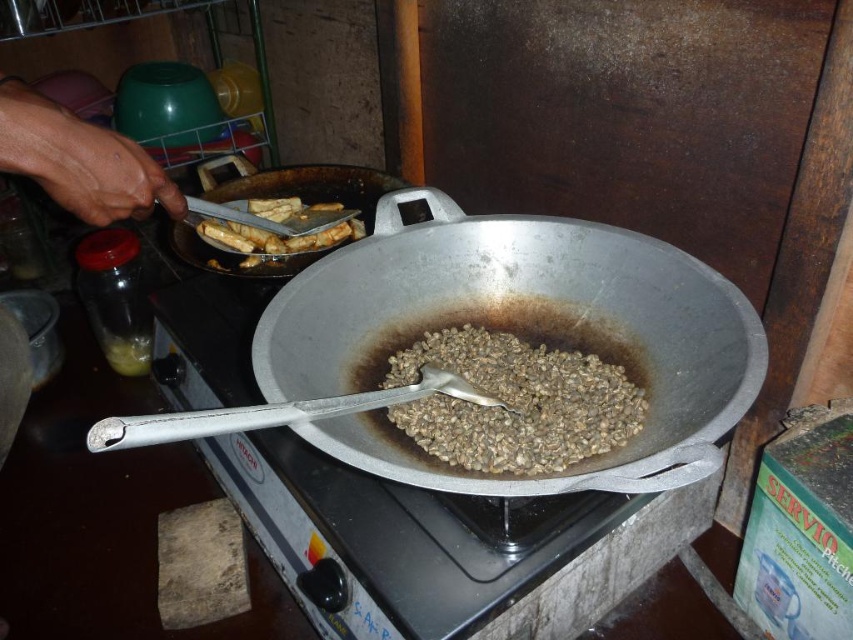
Question: Does shiny silver wok at center have a greater width compared to brown matte beans at center?

Choices:
 (A) yes
 (B) no

Answer: (A)

Question: Is brown matte beans at center closer to the viewer compared to silver metallic frying pan at center?

Choices:
 (A) yes
 (B) no

Answer: (A)

Question: Which point is farther to the camera?

Choices:
 (A) shiny silver wok at center
 (B) silver metallic frying pan at center
 (C) brown crispy fried food at upper left
 (D) brown matte beans at center

Answer: (B)

Question: Based on their relative distances, which object is nearer to the brown crispy fried food at upper left?

Choices:
 (A) brown matte beans at center
 (B) shiny silver wok at center

Answer: (B)

Question: Is brown matte beans at center closer to the viewer compared to silver metallic frying pan at center?

Choices:
 (A) yes
 (B) no

Answer: (A)

Question: Which point is closer to the camera taking this photo?

Choices:
 (A) (340, 282)
 (B) (357, 234)
 (C) (440, 451)
 (D) (294, 182)

Answer: (C)